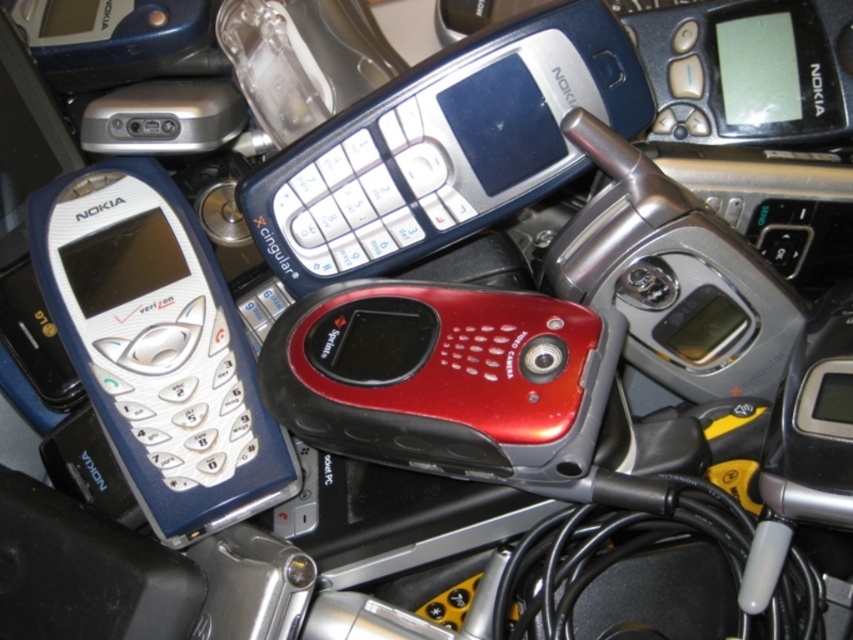
You are organizing a display of vintage phones and need to place a new phone between the metallic blue nokia phone at upper center and the shiny red plastic phone at center. Where should you place it to ensure it fits between them?

The metallic blue nokia phone at upper center is above the shiny red plastic phone at center, so placing the new phone between them would require positioning it in the space directly below the metallic blue nokia phone at upper center and above the shiny red plastic phone at center.

Consider the image. You are organizing a display of vintage phones and need to place a new phone between the matte silver phone at left and the shiny red plastic phone at center. Based on their current positions, which phone should you move to create space?

You should move the matte silver phone at left because the shiny red plastic phone at center is behind it, so moving the matte silver phone at left will create space in front of the shiny red plastic phone at center.

You are organizing a vintage phone exhibition and need to place the metallic blue nokia phone at upper center and the matte silver phone at left on a shelf. Which phone requires more space on the shelf?

The matte silver phone at left requires more space on the shelf because it is larger than the metallic blue nokia phone at upper center.